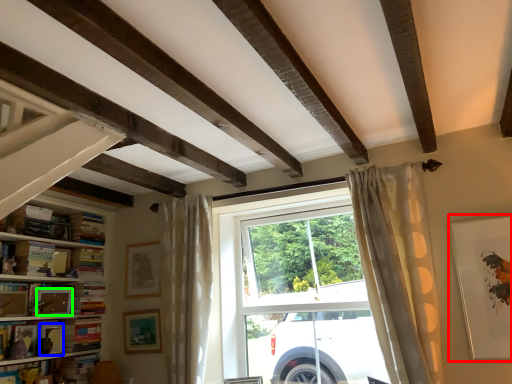
Question: Estimate the real-world distances between objects in this image. Which object is farther from picture frame (highlighted by a red box), picture frame (highlighted by a blue box) or picture frame (highlighted by a green box)?

Choices:
 (A) picture frame
 (B) picture frame

Answer: (A)